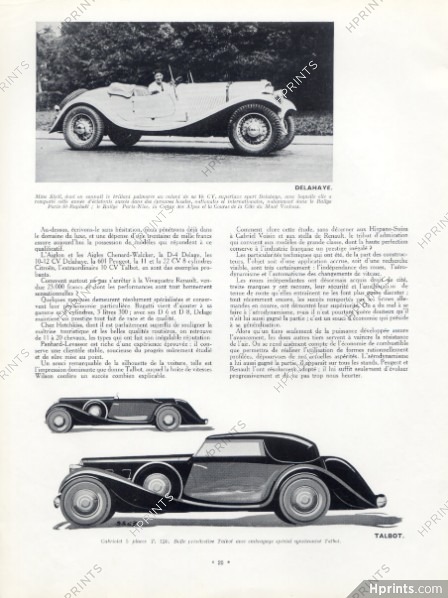
Locate an element on the screen. This screenshot has width=448, height=598. hood is located at coordinates (116, 460), (80, 396), (241, 84).